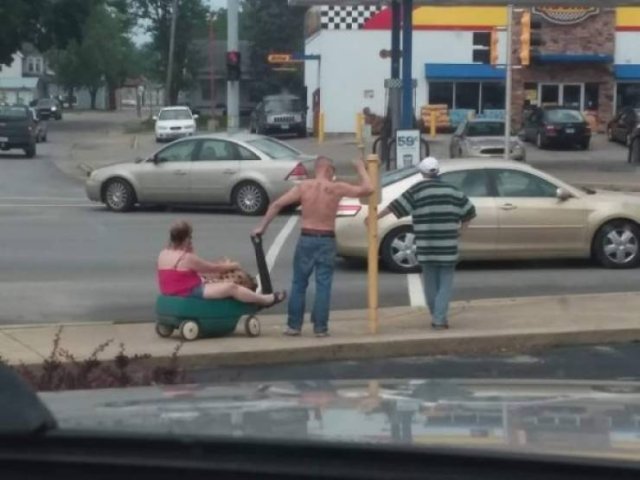
This screenshot has height=480, width=640. Identify the location of wall. (345, 81).